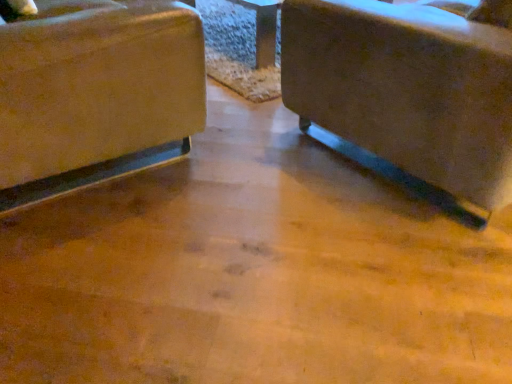
Question: Would you say matte beige fabric chair at left, which is counted as the 2th chair, starting from the right, is inside or outside matte brown chair at center, marked as the 1th chair in a right-to-left arrangement?

Choices:
 (A) outside
 (B) inside

Answer: (A)

Question: Is matte beige fabric chair at left, marked as the 1th chair in a left-to-right arrangement, taller or shorter than matte brown chair at center, marked as the 1th chair in a right-to-left arrangement?

Choices:
 (A) tall
 (B) short

Answer: (A)

Question: Based on their positions, is matte beige fabric chair at left, marked as the 1th chair in a left-to-right arrangement, located to the left or right of matte brown chair at center, marked as the 1th chair in a right-to-left arrangement?

Choices:
 (A) left
 (B) right

Answer: (A)

Question: In terms of size, does matte brown chair at center, arranged as the 2th chair when viewed from the left, appear bigger or smaller than matte beige fabric chair at left, marked as the 1th chair in a left-to-right arrangement?

Choices:
 (A) small
 (B) big

Answer: (B)

Question: In terms of height, does matte brown chair at center, arranged as the 2th chair when viewed from the left, look taller or shorter compared to matte beige fabric chair at left, which is counted as the 2th chair, starting from the right?

Choices:
 (A) tall
 (B) short

Answer: (B)

Question: In terms of width, does matte brown chair at center, arranged as the 2th chair when viewed from the left, look wider or thinner when compared to matte beige fabric chair at left, marked as the 1th chair in a left-to-right arrangement?

Choices:
 (A) thin
 (B) wide

Answer: (B)

Question: Is matte brown chair at center, arranged as the 2th chair when viewed from the left, spatially inside matte beige fabric chair at left, marked as the 1th chair in a left-to-right arrangement, or outside of it?

Choices:
 (A) inside
 (B) outside

Answer: (B)